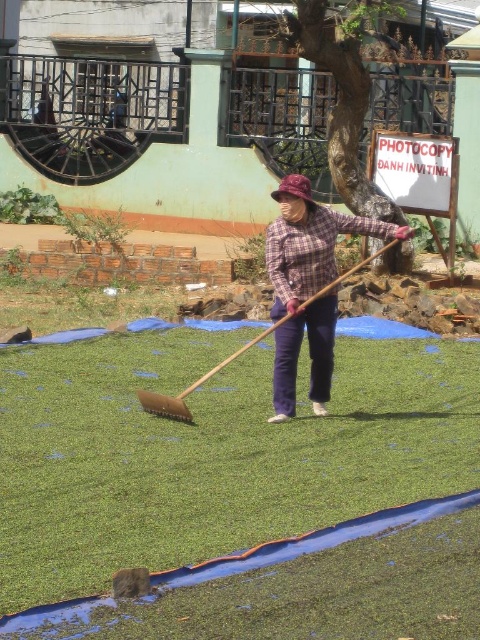
Describe the element at coordinates (240, 490) in the screenshot. Image resolution: width=480 pixels, height=640 pixels. I see `green leafy grass at center` at that location.

Who is lower down, green leafy grass at center or plaid fabric shirt at center?

Positioned lower is green leafy grass at center.

I want to click on green leafy grass at center, so click(x=240, y=490).

Identify the location of green leafy grass at center. This screenshot has height=640, width=480. (240, 490).

Which of these two, green leafy grass at center or wooden shovel at center, stands taller?

wooden shovel at center is taller.

The width and height of the screenshot is (480, 640). What do you see at coordinates (240, 490) in the screenshot?
I see `green leafy grass at center` at bounding box center [240, 490].

Image resolution: width=480 pixels, height=640 pixels. I want to click on green leafy grass at center, so [240, 490].

Is plaid fabric shirt at center taller than wooden shovel at center?

Yes, plaid fabric shirt at center is taller than wooden shovel at center.

Between point (356, 228) and point (171, 400), which one is positioned behind?

The point (356, 228) is behind.

You are a GUI agent. You are given a task and a screenshot of the screen. Output one action in this format:
    pyautogui.click(x=<x>, y=<y>)
    Task: Click on the plaid fabric shirt at center
    The width and height of the screenshot is (480, 640).
    Given the screenshot: What is the action you would take?
    tap(308, 285)